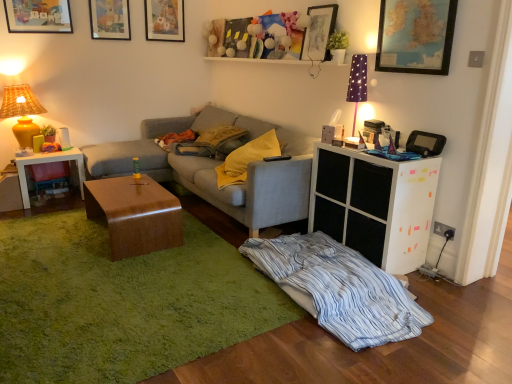
At what (x,y) coordinates should I click in order to perform the action: click on empty space that is ontop of wooden picture frame at upper center, the 2th picture frame positioned from the right (from a real-world perspective). Please return your answer as a coordinate pair (x, y). The height and width of the screenshot is (384, 512). Looking at the image, I should click on (322, 4).